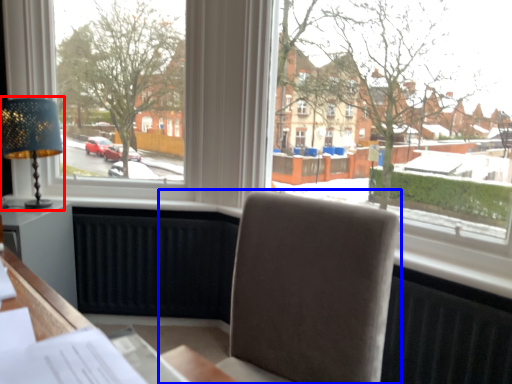
Question: Which point is closer to the camera, table lamp (highlighted by a red box) or chair (highlighted by a blue box)?

Choices:
 (A) table lamp
 (B) chair

Answer: (B)